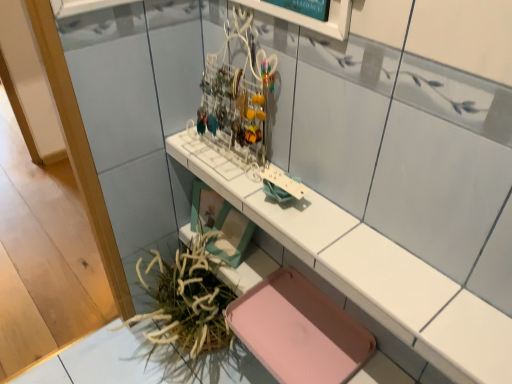
Question: Is white glossy counter at center bigger than green leafy plant at lower left?

Choices:
 (A) yes
 (B) no

Answer: (B)

Question: Is white glossy counter at center oriented towards green leafy plant at lower left?

Choices:
 (A) no
 (B) yes

Answer: (A)

Question: Would you say white glossy counter at center contains green leafy plant at lower left?

Choices:
 (A) yes
 (B) no

Answer: (B)

Question: Is white glossy counter at center not close to green leafy plant at lower left?

Choices:
 (A) no
 (B) yes

Answer: (A)

Question: Does white glossy counter at center have a greater width compared to green leafy plant at lower left?

Choices:
 (A) yes
 (B) no

Answer: (B)

Question: From the image's perspective, would you say white glossy counter at center is positioned over green leafy plant at lower left?

Choices:
 (A) yes
 (B) no

Answer: (A)

Question: From the image's perspective, does green leafy plant at lower left appear higher than white glossy counter at center?

Choices:
 (A) yes
 (B) no

Answer: (B)

Question: Would you say green leafy plant at lower left is outside white glossy counter at center?

Choices:
 (A) yes
 (B) no

Answer: (A)

Question: Does green leafy plant at lower left come behind white glossy counter at center?

Choices:
 (A) yes
 (B) no

Answer: (A)

Question: Is green leafy plant at lower left directly adjacent to white glossy counter at center?

Choices:
 (A) yes
 (B) no

Answer: (B)

Question: Is green leafy plant at lower left wider than white glossy counter at center?

Choices:
 (A) yes
 (B) no

Answer: (A)

Question: Is white glossy counter at center surrounded by green leafy plant at lower left?

Choices:
 (A) yes
 (B) no

Answer: (B)

Question: Is pink matte tray at lower center surrounded by white glossy counter at center?

Choices:
 (A) yes
 (B) no

Answer: (B)